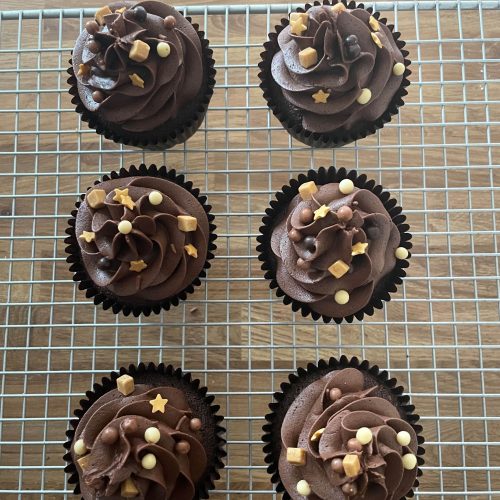
Where is `sprinkle that has fallen through cooling rack onto table surface`? This screenshot has width=500, height=500. sprinkle that has fallen through cooling rack onto table surface is located at coordinates (194, 311).